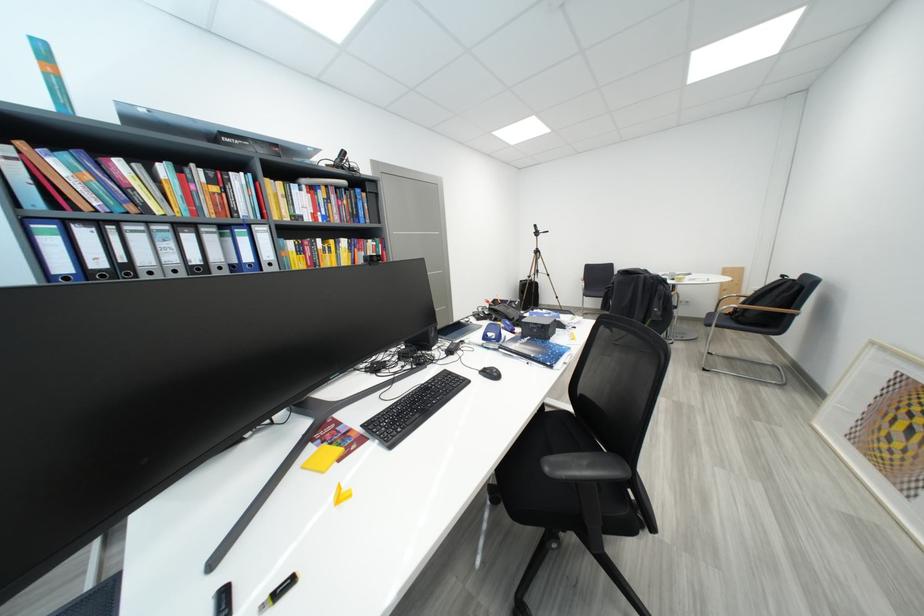
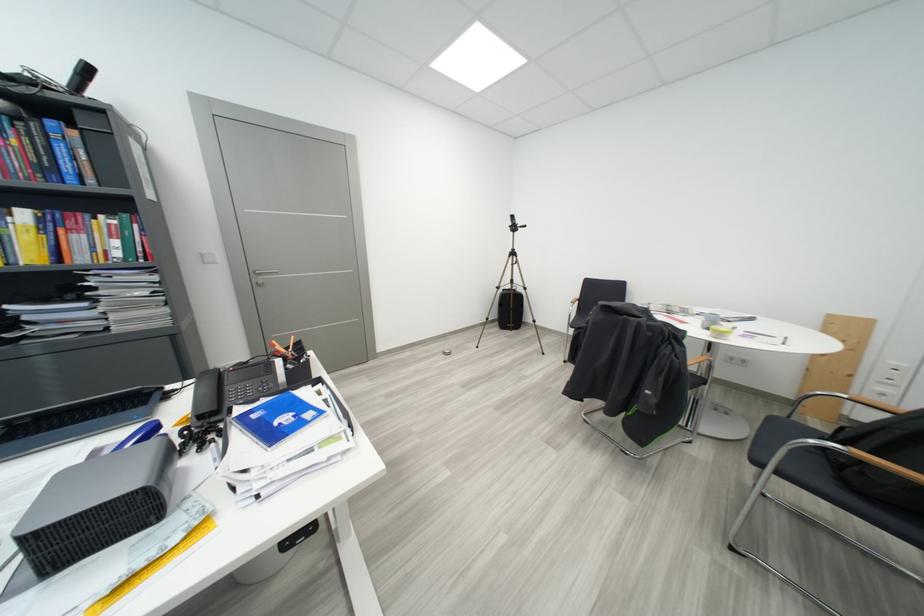
The point at [748,325] is marked in the first image. Where is the corresponding point in the second image?

(856, 487)